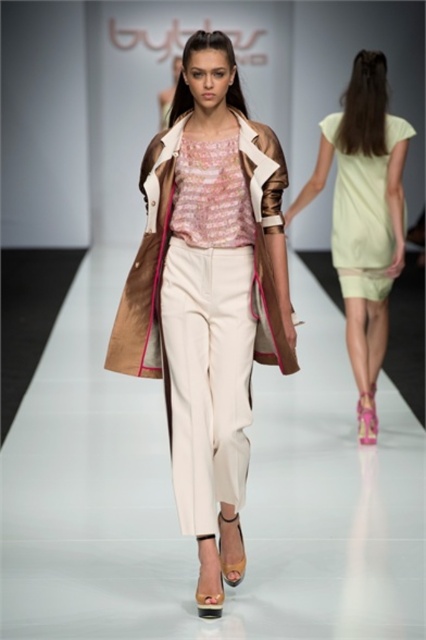
Question: Does metallic gold coat at center appear over light yellow fabric dress at back?

Choices:
 (A) yes
 (B) no

Answer: (B)

Question: Which of the following is the farthest from the observer?

Choices:
 (A) metallic gold coat at center
 (B) light yellow fabric dress at back

Answer: (B)

Question: Can you confirm if metallic gold coat at center is positioned to the right of light yellow fabric dress at back?

Choices:
 (A) yes
 (B) no

Answer: (B)

Question: Can you confirm if metallic gold coat at center is bigger than light yellow fabric dress at back?

Choices:
 (A) no
 (B) yes

Answer: (A)

Question: Which point appears closest to the camera in this image?

Choices:
 (A) (360, 429)
 (B) (158, 276)

Answer: (B)

Question: Among these points, which one is farthest from the camera?

Choices:
 (A) (210, 61)
 (B) (354, 214)

Answer: (B)